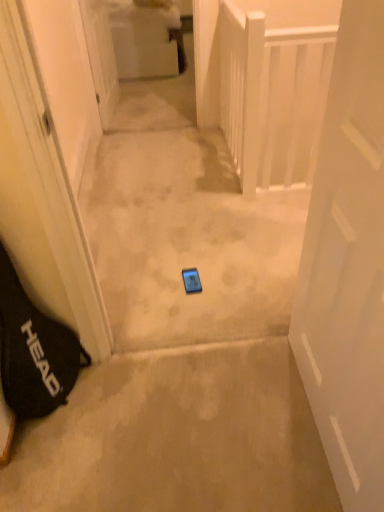
Question: From the image's perspective, is white glossy door at upper center, placed as the 2th door when sorted from front to back, under blue glossy phone at center?

Choices:
 (A) no
 (B) yes

Answer: (A)

Question: Can you confirm if white glossy door at upper center, the second door from the right, is shorter than blue glossy phone at center?

Choices:
 (A) yes
 (B) no

Answer: (B)

Question: Can you confirm if white glossy door at upper center, which is counted as the 1th door, starting from the left, is thinner than blue glossy phone at center?

Choices:
 (A) no
 (B) yes

Answer: (B)

Question: Is white glossy door at upper center, the 1th door viewed from the top, positioned beyond the bounds of blue glossy phone at center?

Choices:
 (A) yes
 (B) no

Answer: (A)

Question: Can you confirm if white glossy door at upper center, placed as the 2th door when sorted from front to back, is wider than blue glossy phone at center?

Choices:
 (A) yes
 (B) no

Answer: (B)

Question: Considering the relative positions of white glossy door at upper center, the first door from the back, and blue glossy phone at center in the image provided, is white glossy door at upper center, the first door from the back, to the left of blue glossy phone at center from the viewer's perspective?

Choices:
 (A) no
 (B) yes

Answer: (B)

Question: Would you consider blue glossy phone at center to be distant from beige carpet at center?

Choices:
 (A) no
 (B) yes

Answer: (A)

Question: Is beige carpet at center surrounded by blue glossy phone at center?

Choices:
 (A) yes
 (B) no

Answer: (B)

Question: Is blue glossy phone at center looking in the opposite direction of beige carpet at center?

Choices:
 (A) no
 (B) yes

Answer: (A)

Question: Can you confirm if blue glossy phone at center is wider than beige carpet at center?

Choices:
 (A) no
 (B) yes

Answer: (B)

Question: Can you confirm if blue glossy phone at center is shorter than beige carpet at center?

Choices:
 (A) no
 (B) yes

Answer: (B)

Question: Is blue glossy phone at center in front of beige carpet at center?

Choices:
 (A) yes
 (B) no

Answer: (B)

Question: From the image's perspective, is black fabric bag at left located above white wooden balustrade at upper right?

Choices:
 (A) yes
 (B) no

Answer: (B)